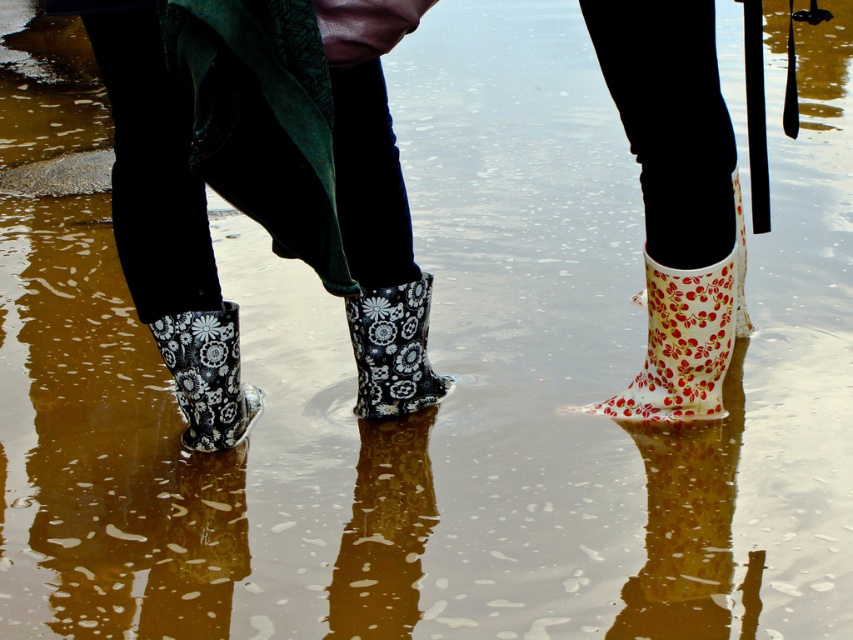
Which is more to the left, floral-patterned rubber boots at left or floral rubber boot at center?

floral-patterned rubber boots at left

The height and width of the screenshot is (640, 853). What do you see at coordinates (262, 180) in the screenshot? I see `floral-patterned rubber boots at left` at bounding box center [262, 180].

Locate an element on the screen. floral-patterned rubber boots at left is located at coordinates (262, 180).

Is floral-patterned rubber boot at right to the right of floral matte rubber boot at lower left from the viewer's perspective?

Yes, floral-patterned rubber boot at right is to the right of floral matte rubber boot at lower left.

Does floral-patterned rubber boot at right have a greater height compared to floral matte rubber boot at lower left?

Indeed, floral-patterned rubber boot at right has a greater height compared to floral matte rubber boot at lower left.

The image size is (853, 640). What are the coordinates of `floral-patterned rubber boot at right` in the screenshot? It's located at (682, 346).

Is floral rubber boot at center positioned at the back of floral matte rubber boot at lower left?

That is True.

Does point (405, 387) come in front of point (231, 380)?

No, (405, 387) is behind (231, 380).

At what (x,y) coordinates should I click in order to perform the action: click on floral rubber boot at center. Please return your answer as a coordinate pair (x, y). Image resolution: width=853 pixels, height=640 pixels. Looking at the image, I should click on (393, 349).

The image size is (853, 640). Find the location of `floral rubber boot at center`. floral rubber boot at center is located at coordinates (393, 349).